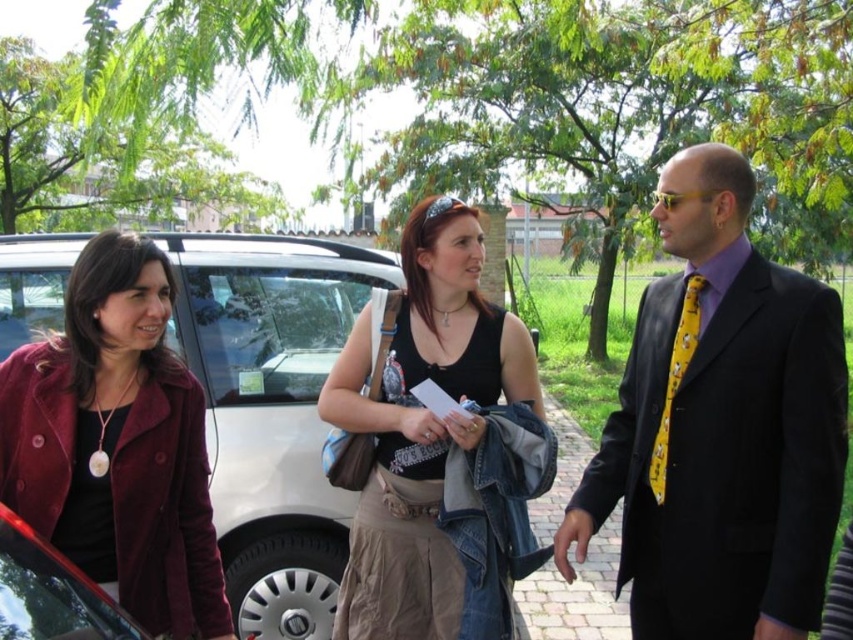
You are a photographer setting up for a group photo. You need to position the velvet maroon coat at left and the yellow printed tie at right so that they are aligned horizontally. Based on their current positions, which adjustment should you make?

The velvet maroon coat at left is currently below the yellow printed tie at right. To align them horizontally, you should move the velvet maroon coat at left upward or lower the yellow printed tie at right downward so that both are at the same vertical level.

You are a photographer trying to capture a photo of the yellow printed tie at right and the metallic red car at lower left. Which object should you focus on first if you want to include both in the frame without moving the camera?

The metallic red car at lower left should be focused on first because it is positioned on the left side of the yellow printed tie at right, so by focusing on the car first, you can ensure both objects are within the frame without needing to reposition the camera.